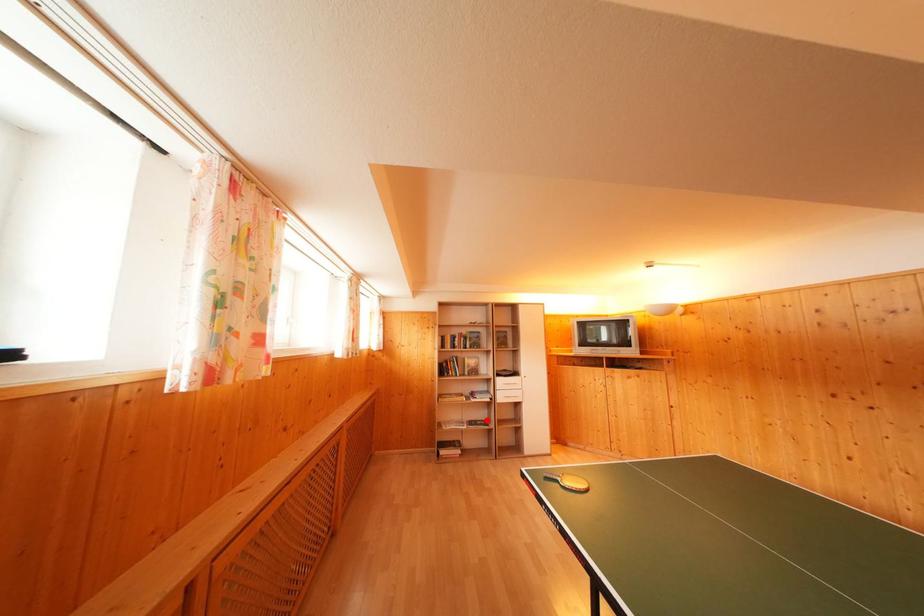
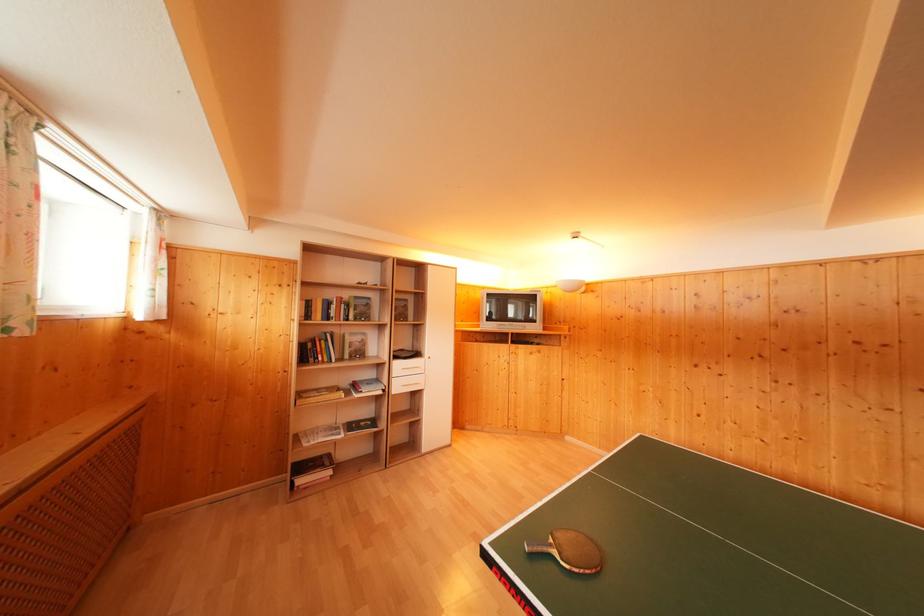
The point at the highlighted location is marked in the first image. Where is the corresponding point in the second image?

(371, 416)